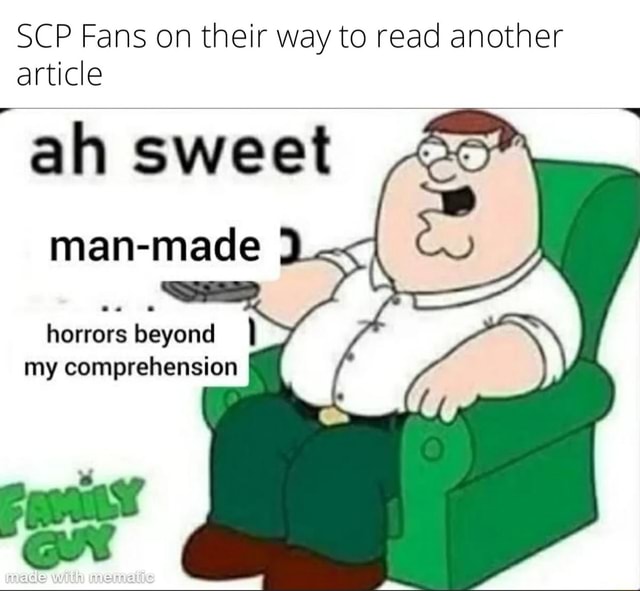
You are a GUI agent. You are given a task and a screenshot of the screen. Output one action in this format:
    pyautogui.click(x=<x>, y=<y>)
    Task: Click on the light green couch
    Image resolution: width=640 pixels, height=591 pixels.
    Given the screenshot: What is the action you would take?
    pyautogui.click(x=502, y=491)